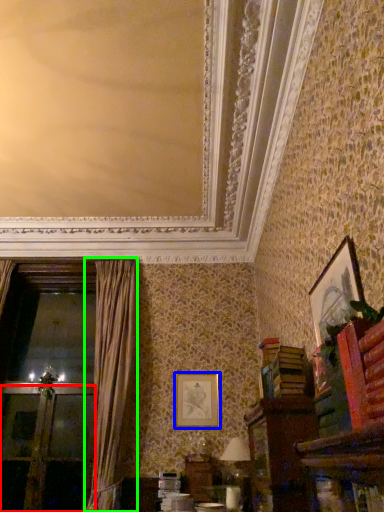
Question: Which object is the farthest from screen door (highlighted by a red box)? Choose among these: picture frame (highlighted by a blue box) or curtain (highlighted by a green box).

Choices:
 (A) picture frame
 (B) curtain

Answer: (A)